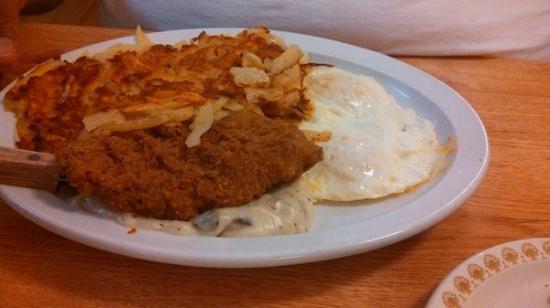
Identify the location of white plate. Image resolution: width=550 pixels, height=308 pixels. (187, 244).